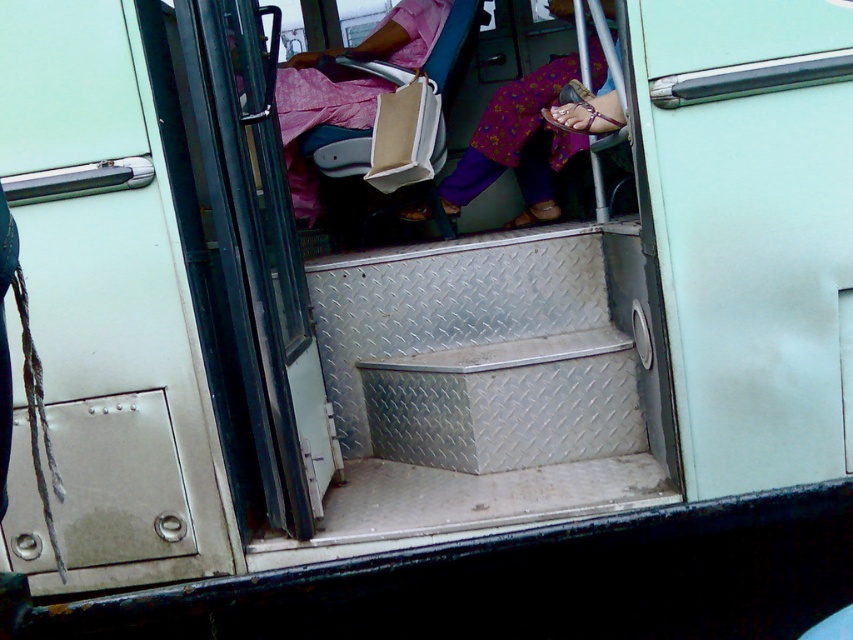
Question: Which of the following is the closest to the observer?

Choices:
 (A) (627, 426)
 (B) (550, 212)

Answer: (A)

Question: Can you confirm if diamond plate metal stairs at center is thinner than floral fabric dress at center?

Choices:
 (A) yes
 (B) no

Answer: (B)

Question: From the image, what is the correct spatial relationship of diamond plate metal stairs at center in relation to floral fabric dress at center?

Choices:
 (A) right
 (B) left

Answer: (B)

Question: Does diamond plate metal stairs at center appear under floral fabric dress at center?

Choices:
 (A) no
 (B) yes

Answer: (B)

Question: Which of the following is the farthest from the observer?

Choices:
 (A) (590, 285)
 (B) (518, 136)

Answer: (B)